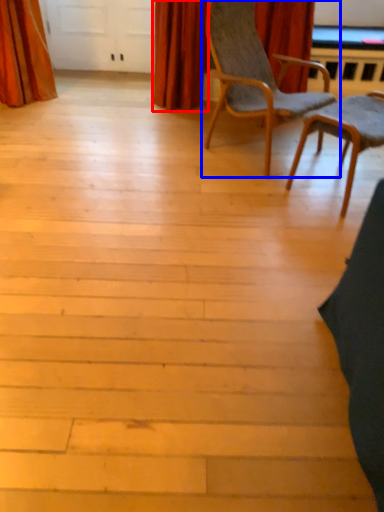
Question: Among these objects, which one is farthest to the camera, curtain (highlighted by a red box) or chair (highlighted by a blue box)?

Choices:
 (A) curtain
 (B) chair

Answer: (A)